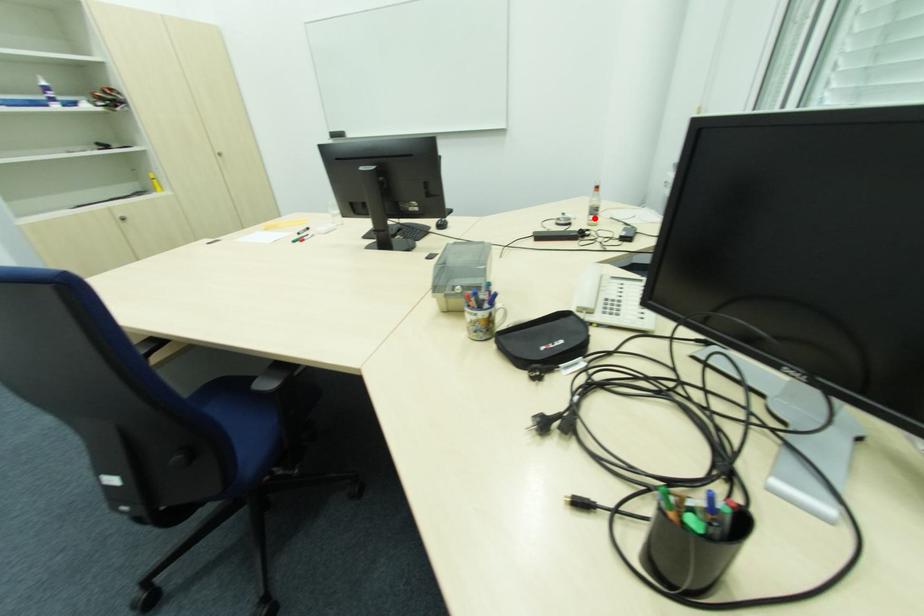
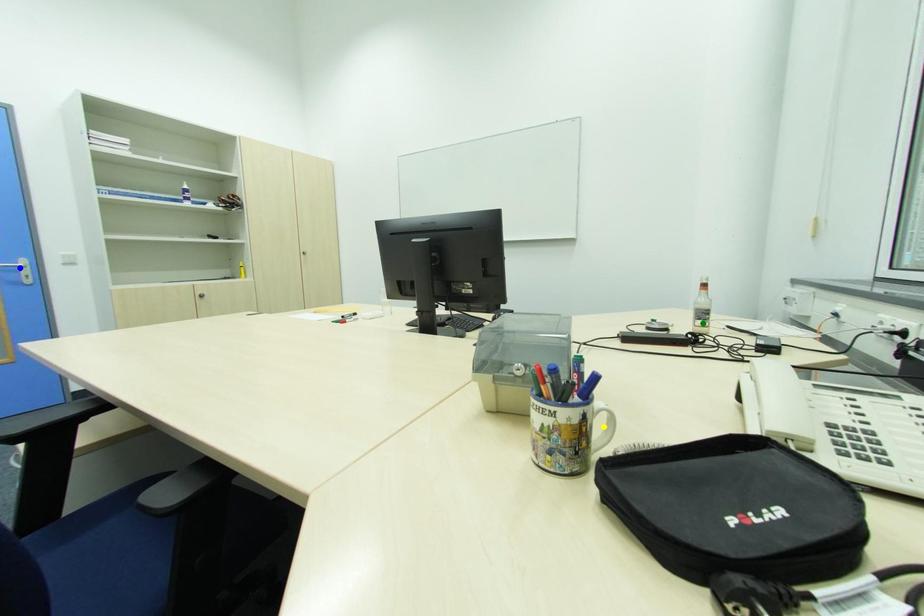
Question: I am providing you with two images of the same scene from different viewpoints. A red point is marked on the first image. You are given multiple points on the second image. Which spot in image 2 lines up with the point in image 1?

Choices:
 (A) blue point
 (B) yellow point
 (C) green point

Answer: (C)